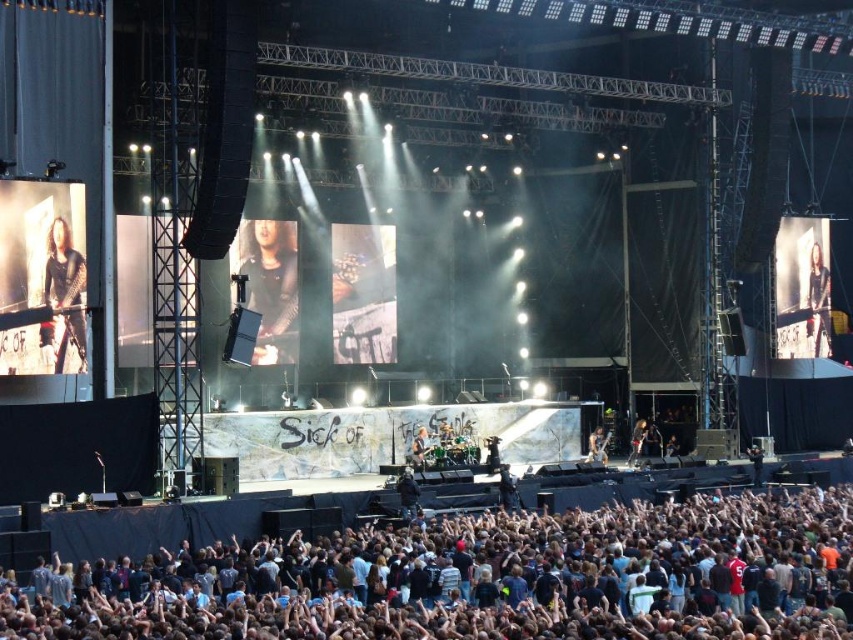
You are standing at the back of the concert venue and want to move to the stage. There are two points marked on the floor for safety checks. The first point is at point [241,268] and the second is at point [589,454]. Which point should you head towards first to reach the stage more quickly?

Point [241,268] is in front of point [589,454], so you should head towards point [241,268] first to reach the stage more quickly since it is closer to the stage.

You are a stagehand at the concert venue and need to place a microphone stand exactly at the coordinates where the matte black guitar at center is located. What are the coordinates where you should place the microphone stand?

The coordinates for the matte black guitar at center are at point (270, 285), so you should place the microphone stand at those coordinates.